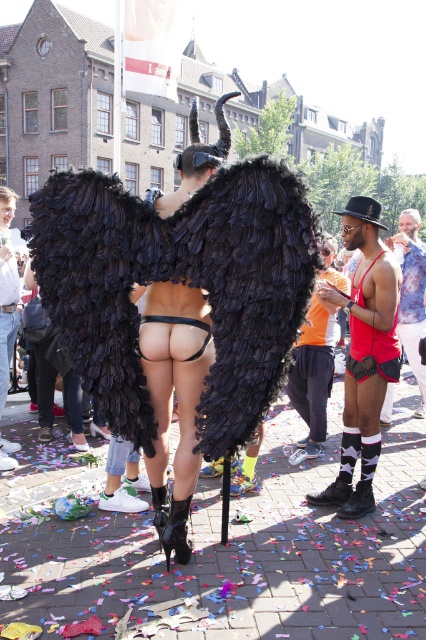
You are standing at point (294, 381) and want to walk to the central figure with the feathered wings and horns. Which direction should you move relative to point (371, 252)?

You should move towards point (371, 252) because it is in front of point (294, 381), so moving towards it will bring you closer to the central figure with the feathered wings and horns.